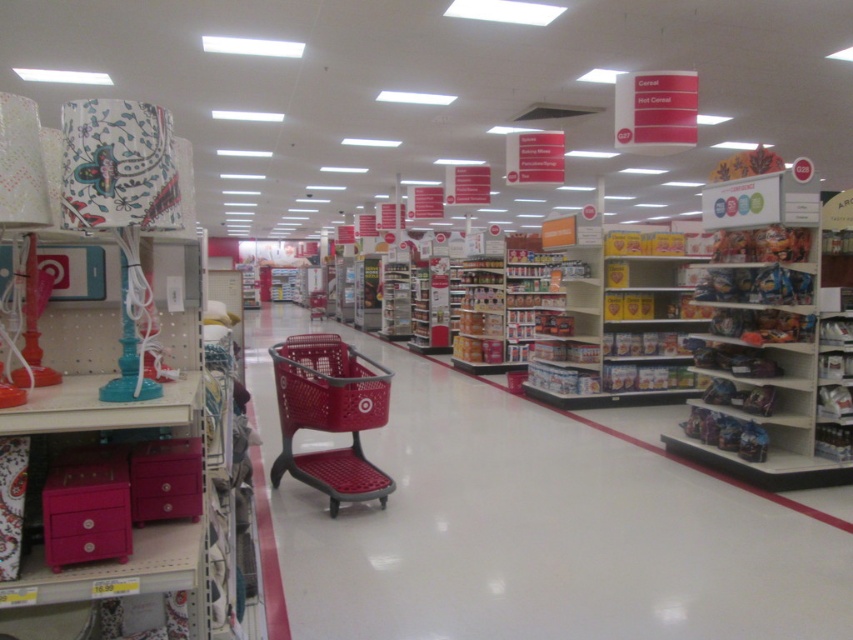
Is plastic shopping cart at center below matte plastic shopping cart at center?

Correct, plastic shopping cart at center is located below matte plastic shopping cart at center.

Does plastic shopping cart at center have a lesser height compared to matte plastic shopping cart at center?

Indeed, plastic shopping cart at center has a lesser height compared to matte plastic shopping cart at center.

Does point (393, 468) come farther from viewer compared to point (345, 387)?

Yes, point (393, 468) is behind point (345, 387).

This screenshot has height=640, width=853. Find the location of `plastic shopping cart at center`. plastic shopping cart at center is located at coordinates (535, 525).